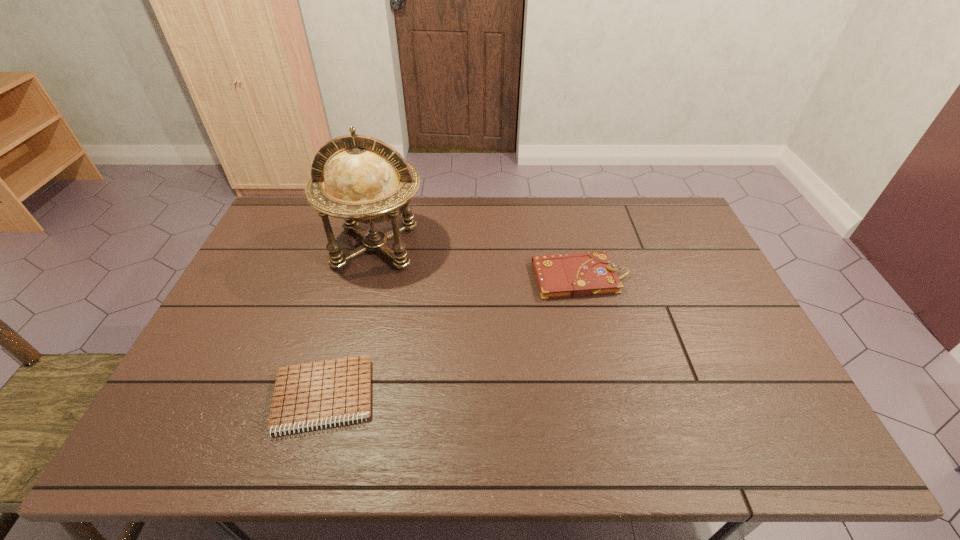
Locate an element on the screen. the tallest object is located at coordinates (367, 181).

Where is `the right notebook`? the right notebook is located at coordinates (583, 274).

You are a GUI agent. You are given a task and a screenshot of the screen. Output one action in this format:
    pyautogui.click(x=<x>, y=<y>)
    Task: Click on the second shortest object
    The width and height of the screenshot is (960, 540).
    Given the screenshot: What is the action you would take?
    pyautogui.click(x=583, y=274)

Where is `the shorter notebook`? The image size is (960, 540). the shorter notebook is located at coordinates (313, 394).

Locate an element on the screen. This screenshot has width=960, height=540. the nearest object is located at coordinates (313, 394).

What are the coordinates of `free spot located on the front-facing side of the tallest object` in the screenshot? It's located at (359, 310).

In order to click on vacant position located on the front of the second tallest object in this screenshot , I will do `click(601, 359)`.

Identify the location of vacant space situated on the right of the shorter notebook. This screenshot has width=960, height=540. (457, 396).

The height and width of the screenshot is (540, 960). I want to click on object that is at the far edge, so click(x=367, y=181).

Find the location of a particular element. object at the near edge is located at coordinates (313, 394).